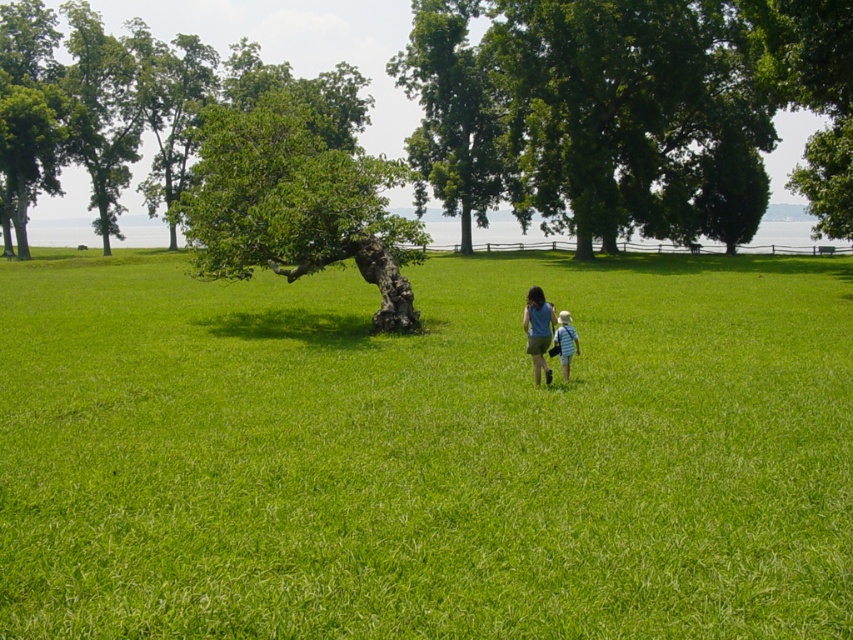
You are standing at the point marked as point (538, 332). Looking around, you see a matte blue shirt at center. What is located at the point you are standing?

The point (538, 332) has a matte blue shirt at center located there.

You are a photographer trying to capture a photo of the green grass at center and the green rough bark tree at center. Which object should you focus on first if you want to include both in your frame without moving the camera?

You should focus on the green rough bark tree at center first because the green grass at center is positioned on the right side of it, so adjusting focus to the tree will help ensure both are in the frame.